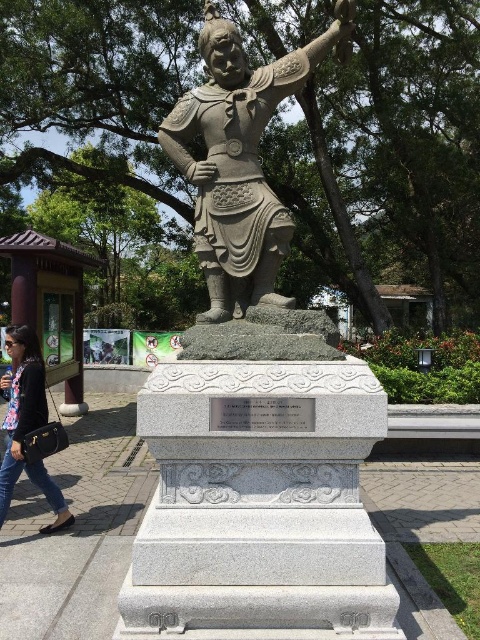
Based on the photo, you are a tour guide explaining the statues in the park. You mention both the gray stone statue at center and the bronze statue at center. Which one is positioned to the right side of the other?

The gray stone statue at center is positioned to the right of the bronze statue at center.

You are standing in front of the stone statue of a warrior in the park. You notice two points marked on the statue base. The first point is at coordinate (351, 458) and the second is at (13, 353). Which point is nearer to your viewpoint?

Point (351, 458) is closer to the camera than point (13, 353).

You are standing at the point marked by coordinates point (253, 404) in the park. What object are you directly standing on?

You are directly standing on the gray stone statue at center marked by point (253, 404).